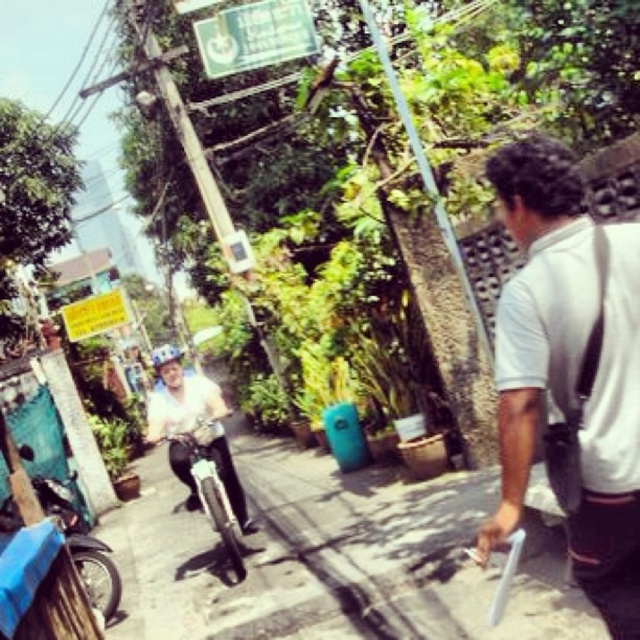
Question: Estimate the real-world distances between objects in this image. Which object is closer to the smooth concrete pavement at center?

Choices:
 (A) shiny silver motorcycle at center
 (B) green plastic sign at upper center

Answer: (A)

Question: Is blue matte motorcycle at lower left in front of shiny silver motorcycle at center?

Choices:
 (A) yes
 (B) no

Answer: (B)

Question: Where is white matte shirt at center located in relation to shiny silver motorcycle at center in the image?

Choices:
 (A) above
 (B) below

Answer: (A)

Question: Does green plastic sign at upper center appear under shiny silver motorcycle at center?

Choices:
 (A) yes
 (B) no

Answer: (B)

Question: Which point is farther from the camera taking this photo?

Choices:
 (A) (109, 589)
 (B) (355, 508)
 (C) (200, 508)

Answer: (B)

Question: Which point is farther from the camera taking this photo?

Choices:
 (A) (516, 204)
 (B) (209, 513)
 (C) (224, 19)
 (D) (380, 486)

Answer: (C)